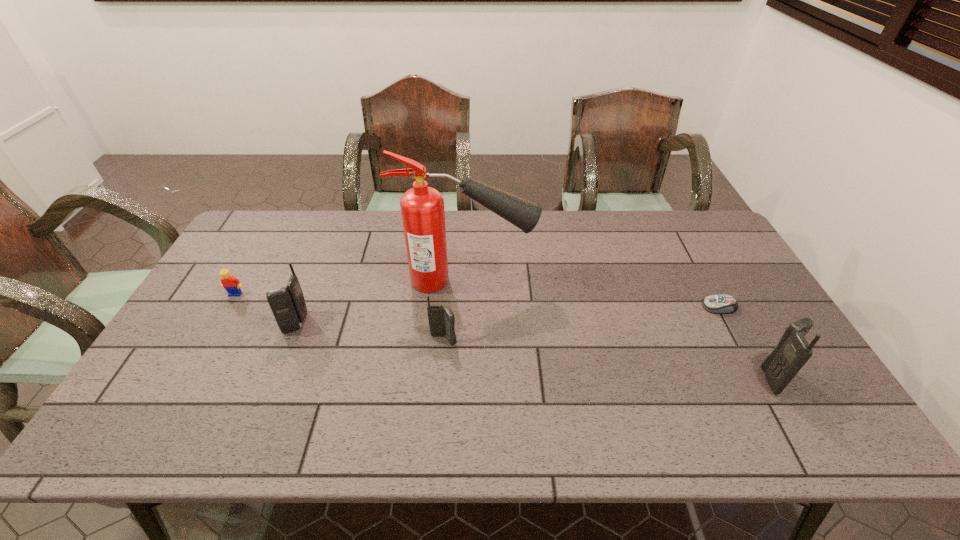
Where is `object present at the near edge`? The width and height of the screenshot is (960, 540). object present at the near edge is located at coordinates (792, 352).

I want to click on object located in the left edge section of the desktop, so click(x=229, y=282).

Find the location of a particular element. cellular telephone at the right edge is located at coordinates pos(792,352).

At what (x,y) coordinates should I click in order to perform the action: click on computer mouse located in the right edge section of the desktop. Please return your answer as a coordinate pair (x, y). This screenshot has height=540, width=960. Looking at the image, I should click on (719, 304).

This screenshot has width=960, height=540. What are the coordinates of `object at the near right corner` in the screenshot? It's located at (792, 352).

Identify the location of vacant space at the far edge. The image size is (960, 540). (486, 230).

At what (x,y) coordinates should I click in order to perform the action: click on free location at the near edge of the desktop. Please return your answer as a coordinate pair (x, y). The height and width of the screenshot is (540, 960). Looking at the image, I should click on (583, 394).

Identify the location of free region at the left edge. The width and height of the screenshot is (960, 540). (199, 327).

Locate an element on the screen. vacant area at the right edge is located at coordinates (683, 255).

Where is `vacant region at the far left corner`? The image size is (960, 540). vacant region at the far left corner is located at coordinates (277, 250).